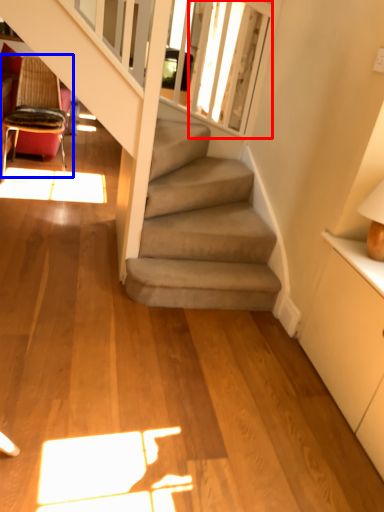
Question: Which object is closer to the camera taking this photo, window screen (highlighted by a red box) or chair (highlighted by a blue box)?

Choices:
 (A) window screen
 (B) chair

Answer: (A)